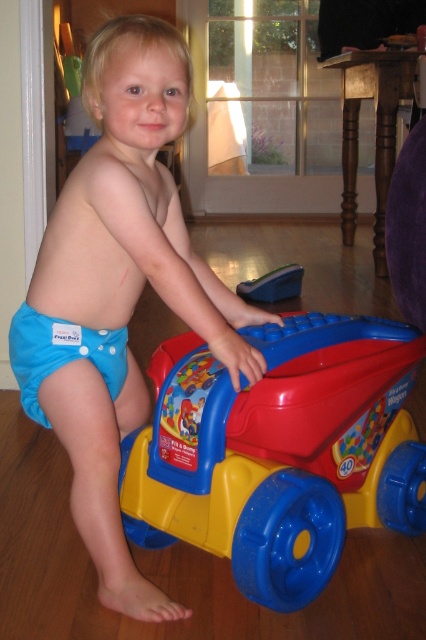
Does matte plastic toy car at lower center have a larger size compared to blue fabric diaper at lower left?

Yes, matte plastic toy car at lower center is bigger than blue fabric diaper at lower left.

Find the location of `matte plastic toy car at lower center`. matte plastic toy car at lower center is located at coordinates (276, 451).

Describe the element at coordinates (118, 289) in the screenshot. I see `blue fabric diaper at center` at that location.

Does blue fabric diaper at center come in front of matte plastic toy car at lower center?

No, it is not.

Which is in front, point (77, 344) or point (337, 516)?

Point (337, 516) is more forward.

Locate an element on the screen. Image resolution: width=426 pixels, height=640 pixels. blue fabric diaper at center is located at coordinates (118, 289).

Image resolution: width=426 pixels, height=640 pixels. I want to click on matte plastic toy car at lower center, so click(x=276, y=451).

Does matte plastic toy car at lower center appear on the left side of blue plastic toy car at center?

Indeed, matte plastic toy car at lower center is positioned on the left side of blue plastic toy car at center.

Identify the location of matte plastic toy car at lower center. (276, 451).

I want to click on matte plastic toy car at lower center, so click(276, 451).